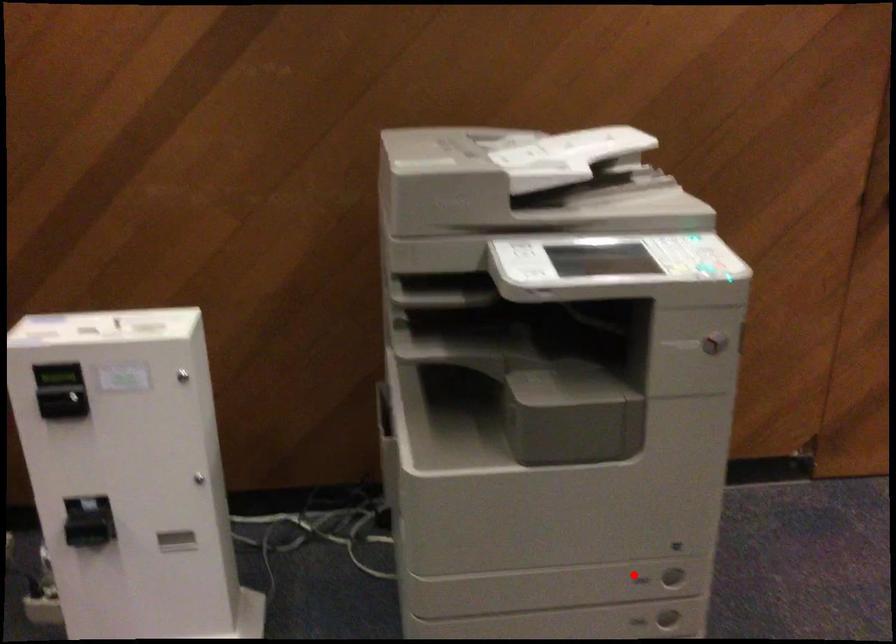
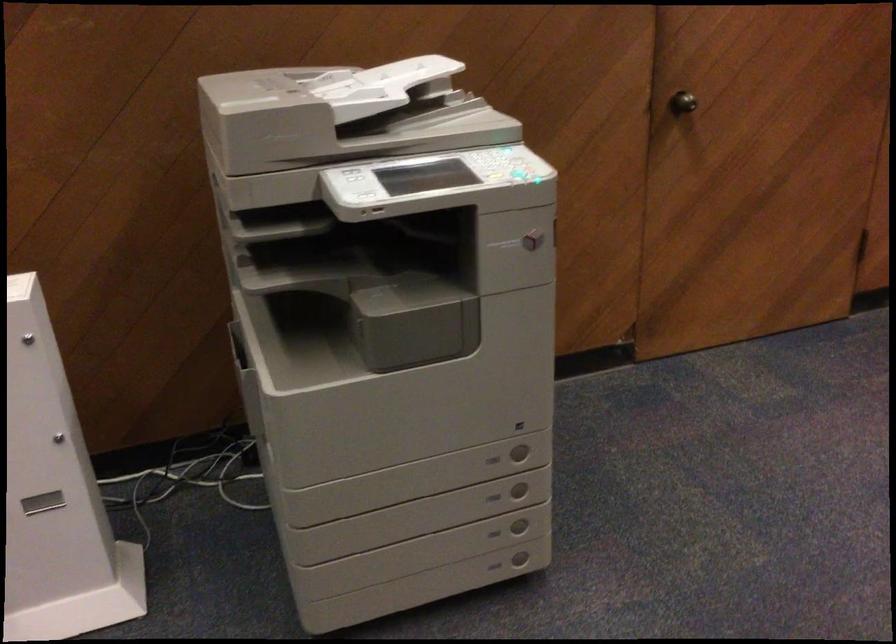
Find the pixel in the second image that matches the highlighted location in the first image.

(492, 459)